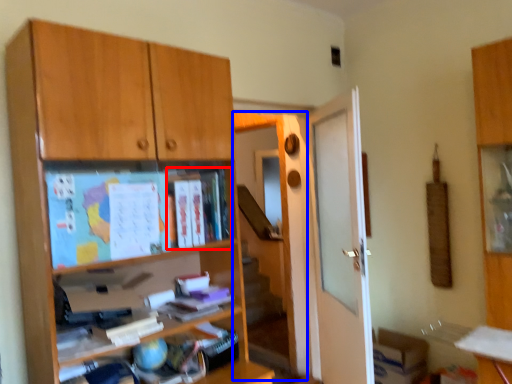
Question: Which object is further to the camera taking this photo, book (highlighted by a red box) or screen door (highlighted by a blue box)?

Choices:
 (A) book
 (B) screen door

Answer: (B)